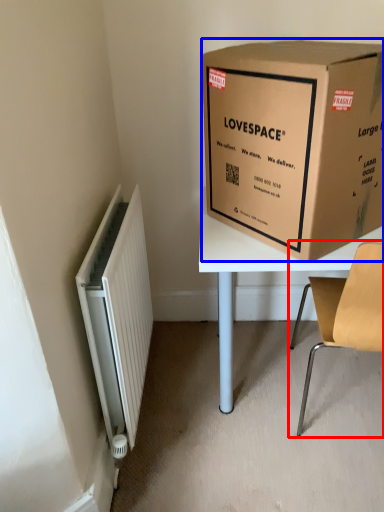
Question: Which object is further to the camera taking this photo, chair (highlighted by a red box) or box (highlighted by a blue box)?

Choices:
 (A) chair
 (B) box

Answer: (A)